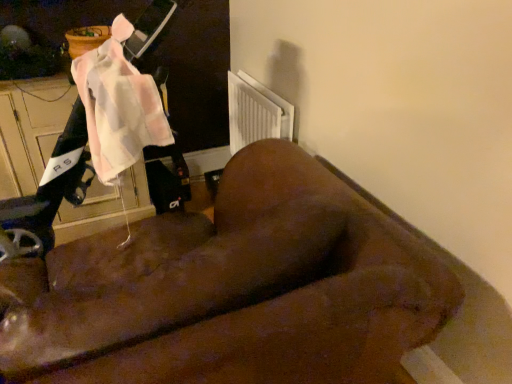
Question: Is pink fabric mobility scooter at upper left wider or thinner than brown fuzzy couch at center?

Choices:
 (A) wide
 (B) thin

Answer: (B)

Question: Considering the relative positions of pink fabric mobility scooter at upper left and brown fuzzy couch at center in the image provided, is pink fabric mobility scooter at upper left to the left or to the right of brown fuzzy couch at center?

Choices:
 (A) right
 (B) left

Answer: (B)

Question: From a real-world perspective, is pink fabric mobility scooter at upper left above or below brown fuzzy couch at center?

Choices:
 (A) below
 (B) above

Answer: (B)

Question: Looking at the image, does brown fuzzy couch at center seem bigger or smaller compared to pink fabric mobility scooter at upper left?

Choices:
 (A) big
 (B) small

Answer: (A)

Question: Choose the correct answer: Is brown fuzzy couch at center inside pink fabric mobility scooter at upper left or outside it?

Choices:
 (A) outside
 (B) inside

Answer: (A)

Question: From the image's perspective, is brown fuzzy couch at center above or below pink fabric mobility scooter at upper left?

Choices:
 (A) below
 (B) above

Answer: (A)

Question: Is brown fuzzy couch at center taller or shorter than pink fabric mobility scooter at upper left?

Choices:
 (A) tall
 (B) short

Answer: (A)